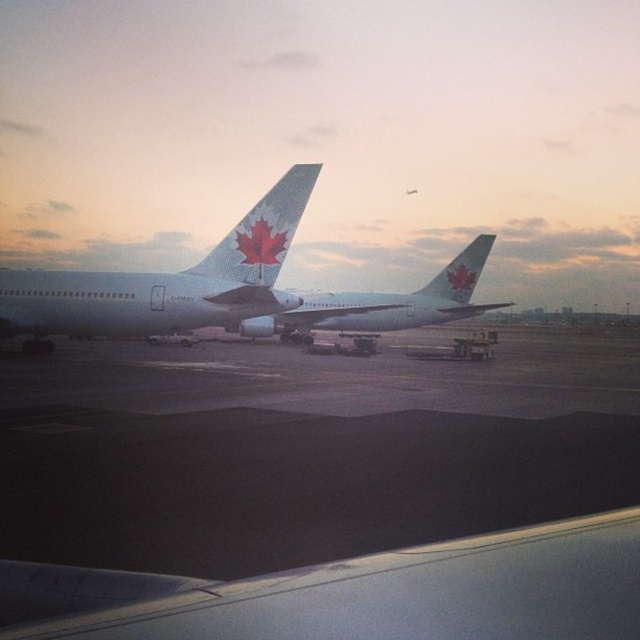
What do you see at coordinates (166, 282) in the screenshot? This screenshot has height=640, width=640. I see `white matte airplane at left` at bounding box center [166, 282].

Based on the photo, does white matte airplane at left appear on the right side of matte white tail at center?

Incorrect, white matte airplane at left is not on the right side of matte white tail at center.

Which is in front, point (122, 307) or point (205, 257)?

Point (122, 307) is more forward.

Where is `white matte airplane at left`? The image size is (640, 640). white matte airplane at left is located at coordinates (166, 282).

Does white matte airplane at left appear on the right side of matte white airplane at center?

Incorrect, white matte airplane at left is not on the right side of matte white airplane at center.

Who is taller, white matte airplane at left or matte white airplane at center?

Standing taller between the two is matte white airplane at center.

Is point (244, 253) farther from camera compared to point (444, 317)?

No, (244, 253) is closer to viewer.

Locate an element on the screen. This screenshot has height=640, width=640. white matte airplane at left is located at coordinates (166, 282).

Can you confirm if matte white airplane at center is thinner than matte white tail at center?

In fact, matte white airplane at center might be wider than matte white tail at center.

Is point (461, 257) farther from camera compared to point (228, 237)?

Yes, point (461, 257) is farther from viewer.

Find the location of a particular element. Image resolution: width=640 pixels, height=640 pixels. matte white airplane at center is located at coordinates (385, 304).